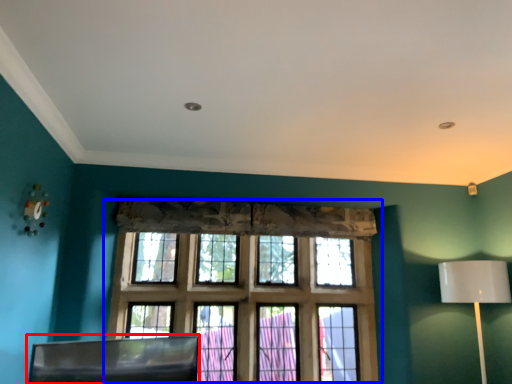
Question: Which of the following is the closest to the observer, swivel chair (highlighted by a red box) or window (highlighted by a blue box)?

Choices:
 (A) swivel chair
 (B) window

Answer: (A)